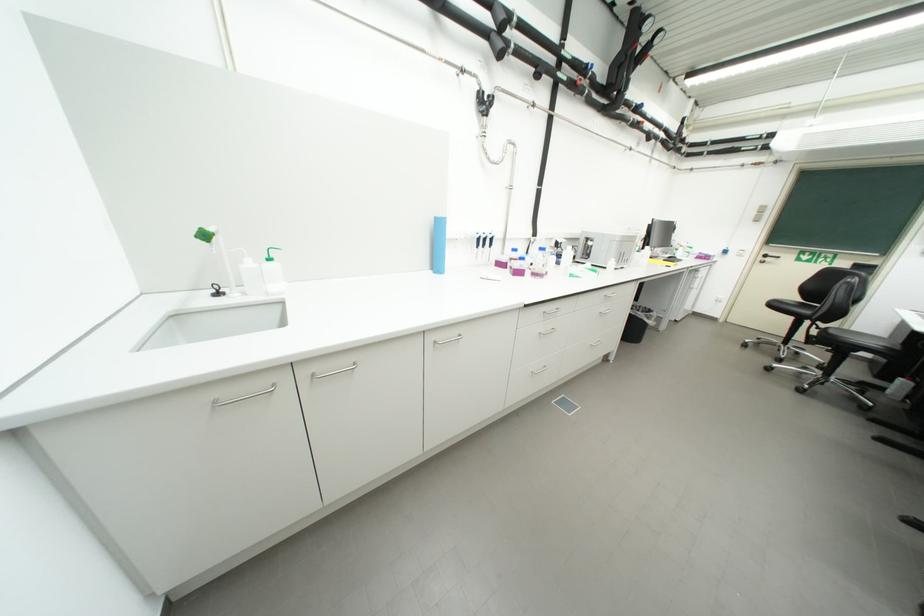
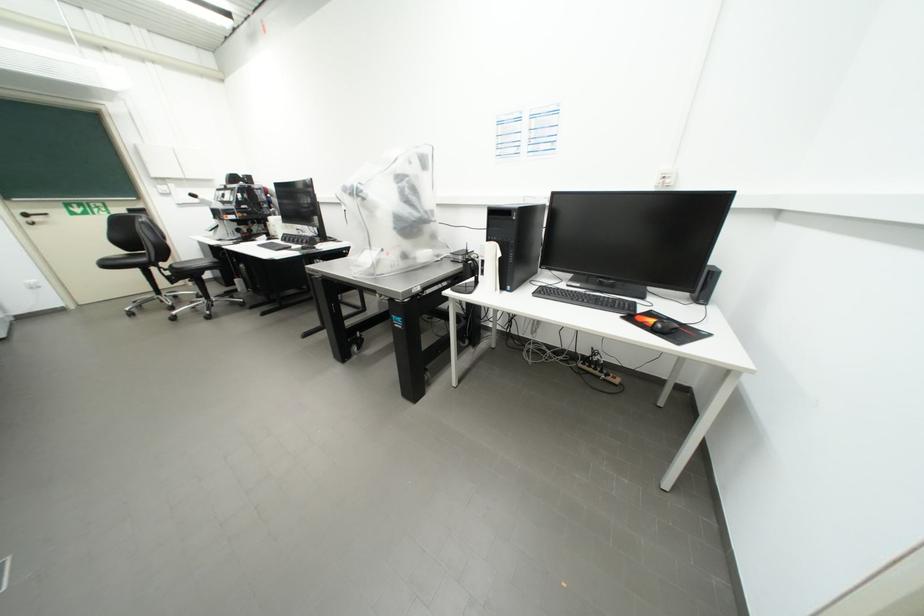
The first image is from the beginning of the video and the second image is from the end. How did the camera likely rotate when shooting the video?

The camera rotated toward right-down.